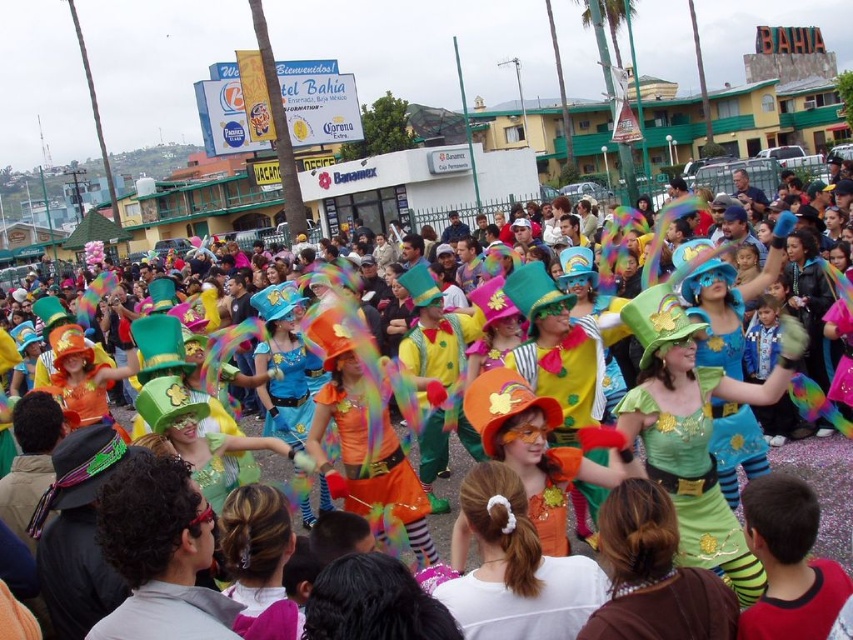
Question: Can you confirm if orange satin dress at center is positioned below orange felt hat at center?

Choices:
 (A) no
 (B) yes

Answer: (B)

Question: Can you confirm if orange satin dress at center is positioned below orange felt hat at center?

Choices:
 (A) yes
 (B) no

Answer: (A)

Question: Considering the real-world distances, which object is closest to the green satin dress at center?

Choices:
 (A) orange felt hat at center
 (B) orange satin dress at center
 (C) shiny green hat at center

Answer: (A)

Question: Which point is closer to the camera taking this photo?

Choices:
 (A) (523, 369)
 (B) (368, 461)

Answer: (B)

Question: Which object is the farthest from the shiny green hat at center?

Choices:
 (A) orange satin dress at center
 (B) green satin dress at center
 (C) orange felt hat at center

Answer: (C)

Question: Is green satin dress at center to the left of shiny green hat at center from the viewer's perspective?

Choices:
 (A) yes
 (B) no

Answer: (B)